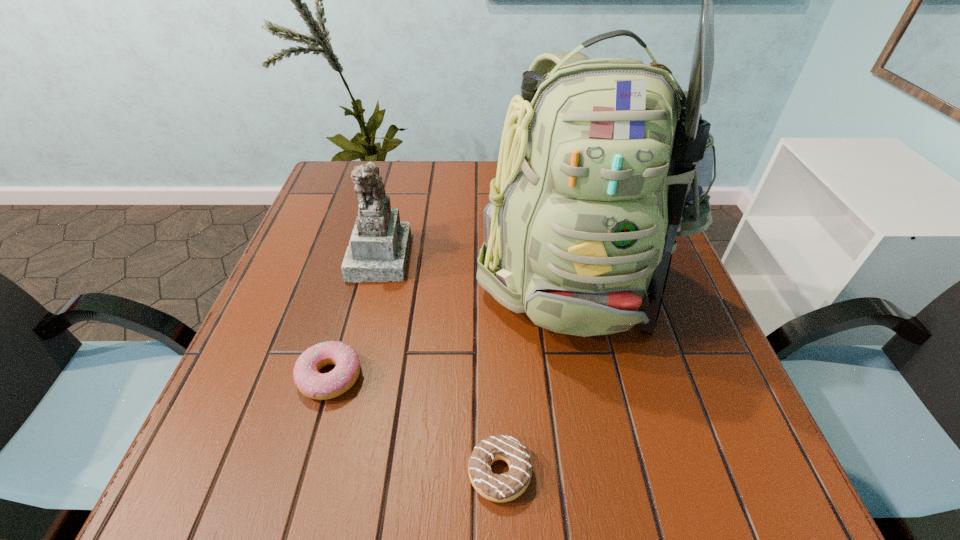
Where is `free spot between the third shortest object and the farther doughnut`? This screenshot has width=960, height=540. free spot between the third shortest object and the farther doughnut is located at coordinates (355, 316).

You are a GUI agent. You are given a task and a screenshot of the screen. Output one action in this format:
    pyautogui.click(x=<x>, y=<y>)
    Task: Click on the free space between the right doughnut and the second tallest object
    The height and width of the screenshot is (540, 960).
    Given the screenshot: What is the action you would take?
    pyautogui.click(x=440, y=364)

Where is `free area in between the nearest object and the backpack`? This screenshot has width=960, height=540. free area in between the nearest object and the backpack is located at coordinates (537, 372).

Where is `vacant space that is in between the third shortest object and the shorter doughnut`? The width and height of the screenshot is (960, 540). vacant space that is in between the third shortest object and the shorter doughnut is located at coordinates (440, 364).

This screenshot has height=540, width=960. Find the location of `vacant space that's between the third shortest object and the right doughnut`. vacant space that's between the third shortest object and the right doughnut is located at coordinates (440, 364).

You are a GUI agent. You are given a task and a screenshot of the screen. Output one action in this format:
    pyautogui.click(x=<x>, y=<y>)
    Task: Click on the empty location between the shortest object and the third shortest object
    
    Given the screenshot: What is the action you would take?
    pyautogui.click(x=440, y=364)

Image resolution: width=960 pixels, height=540 pixels. In order to click on vacant space that is in between the farther doughnut and the third shortest object in this screenshot , I will do `click(355, 316)`.

What are the coordinates of `free space between the right doughnut and the second tallest object` in the screenshot? It's located at (440, 364).

The image size is (960, 540). Find the location of `vacant point located between the shortest object and the backpack`. vacant point located between the shortest object and the backpack is located at coordinates (537, 372).

Identify the location of free space between the nearer doughnut and the figurine. This screenshot has height=540, width=960. (440, 364).